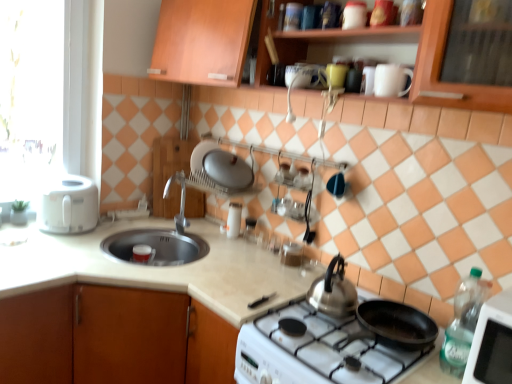
Question: Based on their sizes in the image, would you say white matte mug at upper center, positioned as the 2th mug in top-to-bottom order, is bigger or smaller than metallic silver canister at upper center, positioned as the fourth appliance in bottom-to-top order?

Choices:
 (A) big
 (B) small

Answer: (A)

Question: Relative to metallic silver canister at upper center, marked as the first appliance in a top-to-bottom arrangement, is white matte mug at upper center, which appears as the second mug when viewed from the left, in front or behind?

Choices:
 (A) behind
 (B) front

Answer: (B)

Question: Estimate the real-world distances between objects in this image. Which object is farther from the white plastic toaster at left?

Choices:
 (A) beige laminate countertop at center, placed as the 1th countertop when sorted from left to right
 (B) wooden cabinet at upper center, placed as the second cabinetry when sorted from bottom to top
 (C) green plastic bottle at lower right, the first kitchen appliance when ordered from front to back
 (D) silver metallic faucet at center
 (E) white glossy soap dispenser at upper center, the fourth appliance positioned from the front

Answer: (C)

Question: Which object is the farthest from the wooden cabinet at center, positioned as the first cabinetry in back-to-front order?

Choices:
 (A) white plastic toaster at left, positioned as the 1th kitchen appliance in back-to-front order
 (B) metallic silver canister at upper center, marked as the first appliance in a top-to-bottom arrangement
 (C) silver metallic faucet at center
 (D) white glossy cup at upper center, arranged as the 3th appliance when ordered from the bottom
 (E) white plastic toaster at left

Answer: (D)